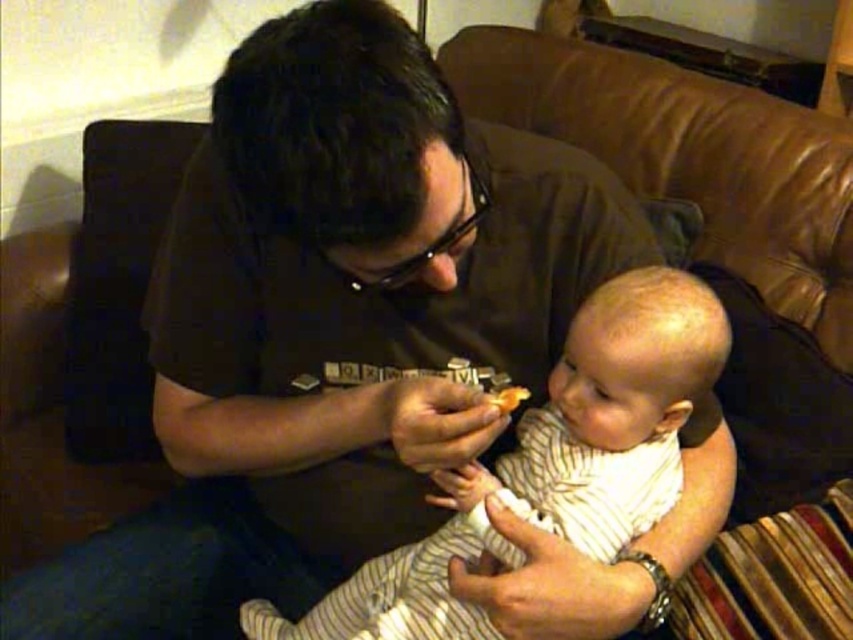
Question: Does striped cotton onesie at center lie in front of yellow matte cookie at center?

Choices:
 (A) no
 (B) yes

Answer: (B)

Question: Which object is farther from the camera taking this photo?

Choices:
 (A) striped cotton onesie at center
 (B) yellow matte cookie at center

Answer: (B)

Question: Is striped cotton onesie at center positioned behind yellow matte cookie at center?

Choices:
 (A) no
 (B) yes

Answer: (A)

Question: Among these objects, which one is farthest from the camera?

Choices:
 (A) striped cotton onesie at center
 (B) yellow matte cookie at center

Answer: (B)

Question: Considering the relative positions of striped cotton onesie at center and yellow matte cookie at center in the image provided, where is striped cotton onesie at center located with respect to yellow matte cookie at center?

Choices:
 (A) below
 (B) above

Answer: (A)

Question: Which point is farther from the camera taking this photo?

Choices:
 (A) (508, 404)
 (B) (479, 556)

Answer: (B)